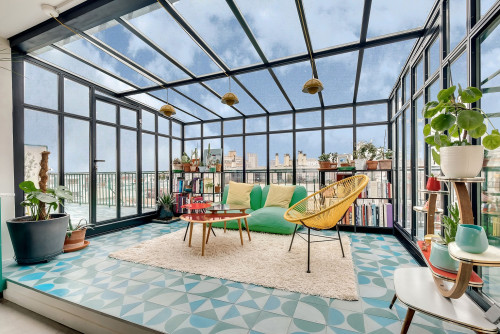
At what (x,y) coordinates should I click in order to perform the action: click on light fixture. Please return your answer as a coordinate pair (x, y). Looking at the image, I should click on (166, 111), (227, 101), (314, 85).